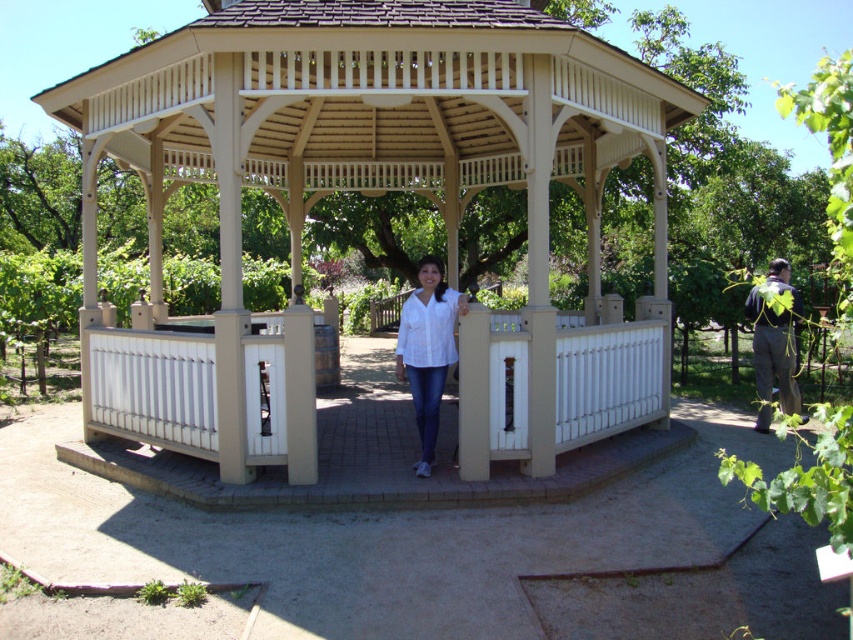
You are standing at the entrance of the park and want to find the beige wood gazebo at center. According to the map, your current position is at point A, which is at coordinates 0.281, 0.441. Can you confirm if the gazebo is exactly where you are standing?

The beige wood gazebo at center is located at point (375, 179), so yes, you are currently standing at the exact location of the gazebo.

You are a visitor at the park and want to take a photo of the beige wood gazebo at center and the gray fabric jacket at lower right. Which object should you focus on first if you want to capture both in the same frame without moving the camera?

You should focus on the beige wood gazebo at center first because it is shorter than the gray fabric jacket at lower right, allowing both to fit within the frame when starting from the lower part.

You are a photographer taking a picture of the beige wood gazebo at center and the white matte shirt at center. Which object should you focus on first if you want to capture both in sharp focus?

The beige wood gazebo at center is below the white matte shirt at center, so you should focus on the white matte shirt at center first to ensure both are in sharp focus.